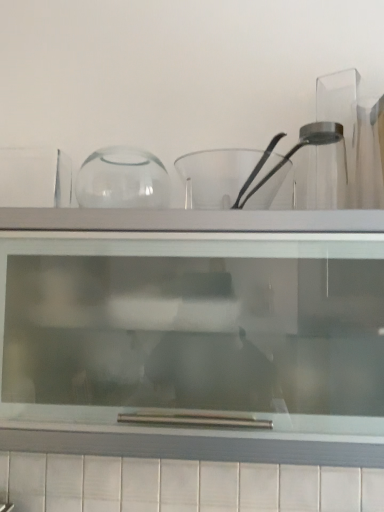
Question: Does transparent glass shelf at upper center have a larger size compared to transparent glass bowl at center?

Choices:
 (A) yes
 (B) no

Answer: (A)

Question: Does transparent glass shelf at upper center have a greater height compared to transparent glass bowl at center?

Choices:
 (A) yes
 (B) no

Answer: (A)

Question: Is transparent glass shelf at upper center to the left of transparent glass bowl at center from the viewer's perspective?

Choices:
 (A) no
 (B) yes

Answer: (B)

Question: Considering the relative positions of transparent glass shelf at upper center and transparent glass bowl at center in the image provided, is transparent glass shelf at upper center behind transparent glass bowl at center?

Choices:
 (A) yes
 (B) no

Answer: (B)

Question: From a real-world perspective, is transparent glass shelf at upper center located higher than transparent glass bowl at center?

Choices:
 (A) no
 (B) yes

Answer: (A)

Question: From a real-world perspective, is transparent glass shelf at upper center below transparent glass bowl at center?

Choices:
 (A) yes
 (B) no

Answer: (A)

Question: Is transparent glass bowl at center not close to transparent glass shelf at upper center?

Choices:
 (A) no
 (B) yes

Answer: (A)

Question: From the image's perspective, is transparent glass bowl at center above transparent glass shelf at upper center?

Choices:
 (A) yes
 (B) no

Answer: (A)

Question: Is transparent glass bowl at center not inside transparent glass shelf at upper center?

Choices:
 (A) yes
 (B) no

Answer: (A)

Question: Does transparent glass bowl at center have a greater height compared to transparent glass shelf at upper center?

Choices:
 (A) yes
 (B) no

Answer: (B)

Question: Is transparent glass bowl at center shorter than transparent glass shelf at upper center?

Choices:
 (A) yes
 (B) no

Answer: (A)

Question: From the image's perspective, is transparent glass bowl at center beneath transparent glass shelf at upper center?

Choices:
 (A) yes
 (B) no

Answer: (B)

Question: From their relative heights in the image, would you say transparent glass shelf at upper center is taller or shorter than transparent glass bowl at center?

Choices:
 (A) tall
 (B) short

Answer: (A)